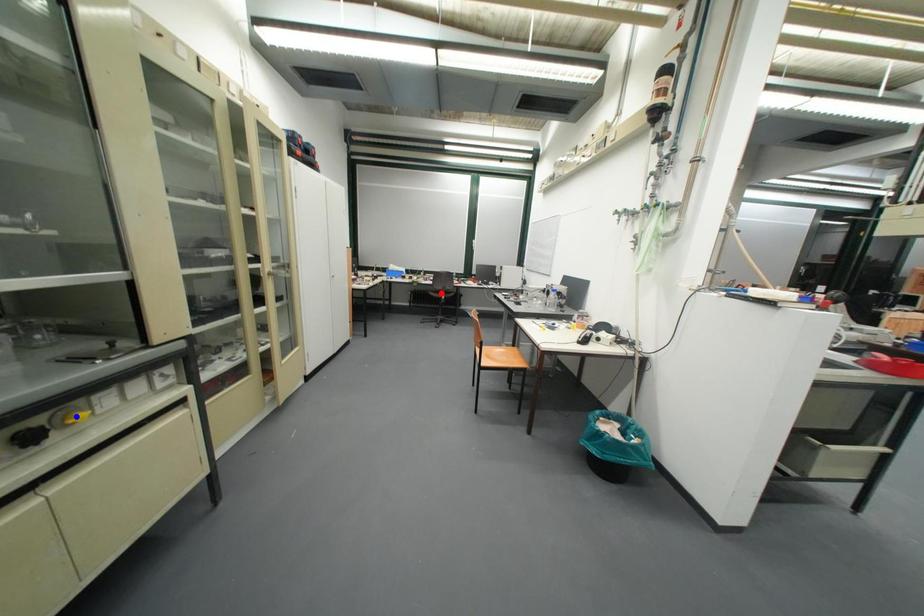
Question: Which of the two points in the image is closer to the camera?

Choices:
 (A) Blue point is closer.
 (B) Red point is closer.

Answer: (A)